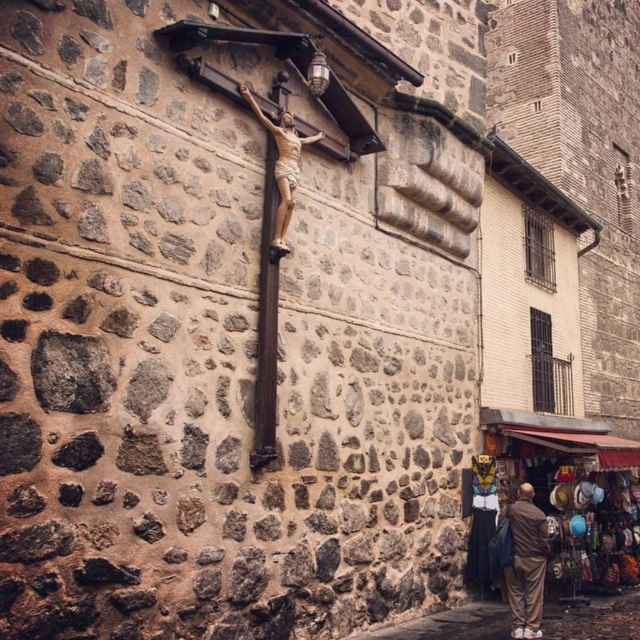
You are a tourist standing in front of the stone wall. You see the brown fabric pants at lower right and the wooden crucifix at center. Which object is positioned to the right of the other?

The brown fabric pants at lower right are positioned to the right of the wooden crucifix at center.

From the picture: You are standing in front of the stone wall with the crucifixion figure. There is a point marked at coordinates (525, 563). What object is located at this point?

The point at (525, 563) marks the brown fabric pants at lower right.